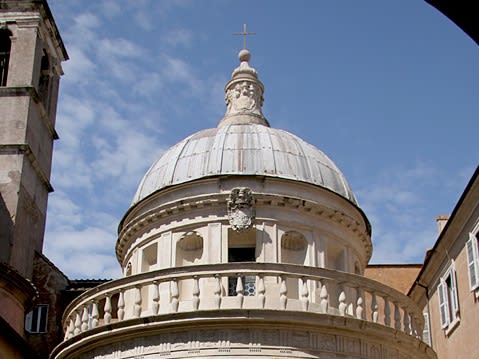
This screenshot has height=359, width=479. I want to click on banister, so click(235, 266).